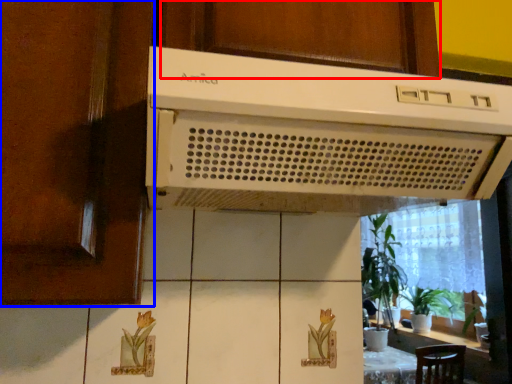
Question: Which object is further to the camera taking this photo, cabinetry (highlighted by a red box) or screen door (highlighted by a blue box)?

Choices:
 (A) cabinetry
 (B) screen door

Answer: (A)